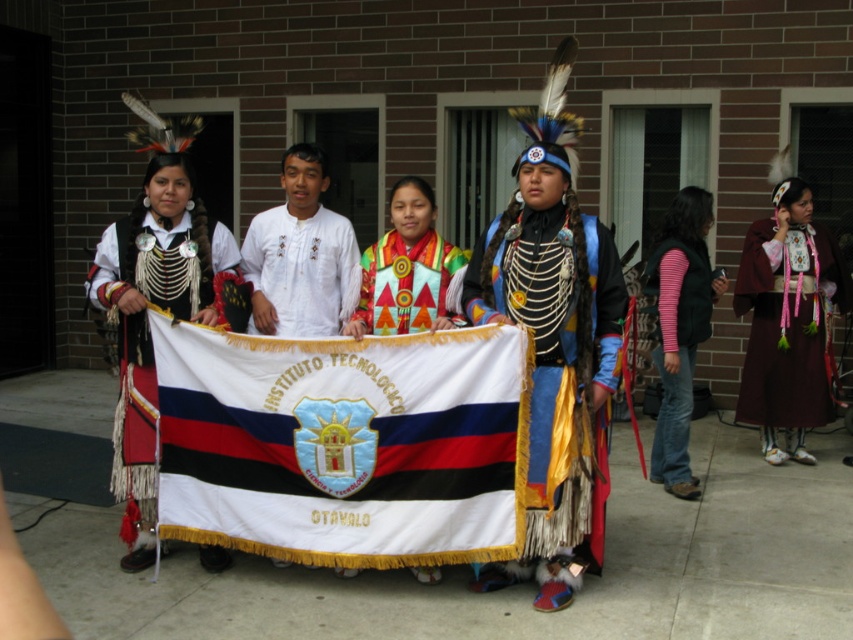
You are a photographer trying to capture the banner in the scene. You notice the matte black and white fabric at center and the pink striped sleeve at lower right. Which object is blocking your view of the banner?

The matte black and white fabric at center is blocking your view of the banner because it is in front of the pink striped sleeve at lower right.

You are taking a photo of the group holding the banner. You want to focus on the point at point (173, 296) and point (688, 376). Which point should you adjust your focus to first to ensure both are in sharp focus?

You should focus on point (173, 296) first because it is closer to the camera than point (688, 376). By focusing on the closer point, the farther point will also be in focus due to the depth of field.

You are a photographer trying to capture the central figures in the scene. Which object, the white fabric flag at center or the textured fabric vest at center, is closer to the camera?

The textured fabric vest at center is closer to the camera because the white fabric flag at center is positioned under it.